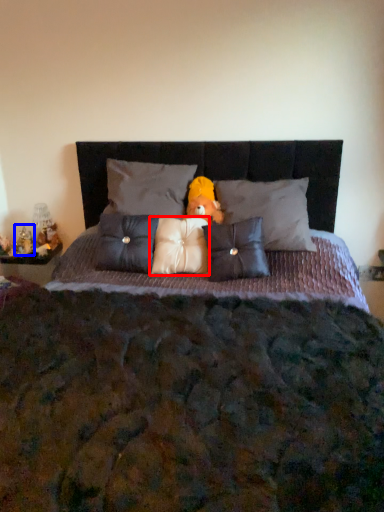
Question: Which of the following is the farthest to the observer, pillow (highlighted by a red box) or figurine (highlighted by a blue box)?

Choices:
 (A) pillow
 (B) figurine

Answer: (B)